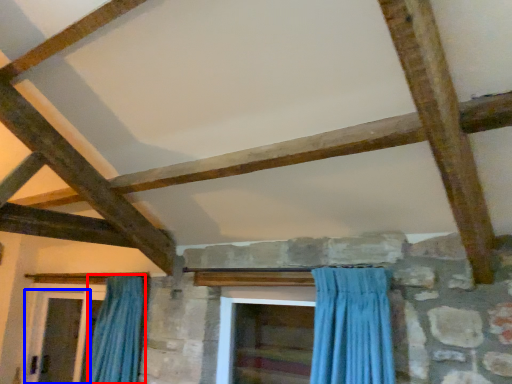
Question: Which point is further to the camera, curtain (highlighted by a red box) or screen door (highlighted by a blue box)?

Choices:
 (A) curtain
 (B) screen door

Answer: (B)